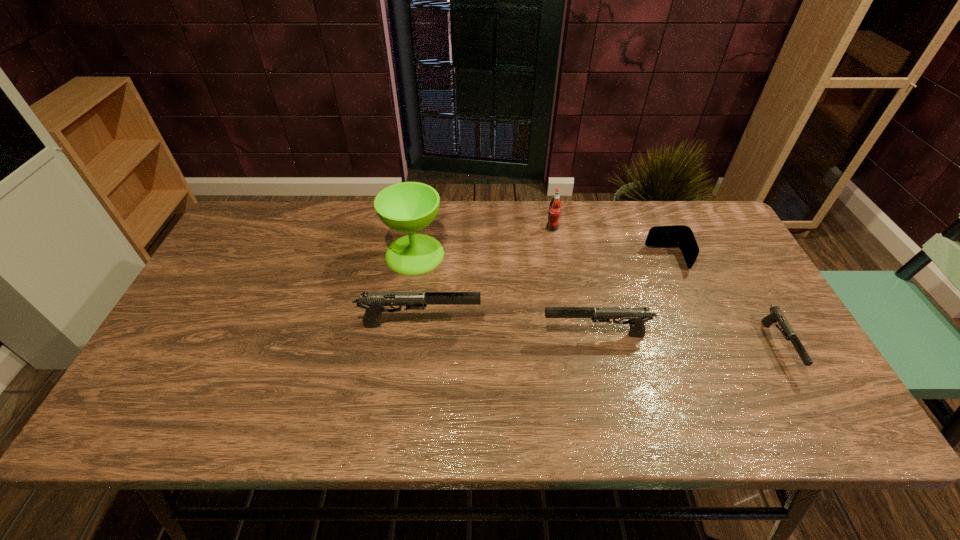
Identify the location of free spot between the tallest object and the shortest gun. (x=596, y=300).

Identify the location of free space between the leftmost gun and the shortest object. (599, 335).

Identify the location of empty location between the wallet and the soda bottle. This screenshot has width=960, height=540. (610, 244).

The height and width of the screenshot is (540, 960). Identify the location of free space between the wallet and the tallest object. (541, 256).

The image size is (960, 540). I want to click on unoccupied position between the second gun from left to right and the soda bottle, so click(574, 282).

Image resolution: width=960 pixels, height=540 pixels. Find the location of `free spot between the tallest object and the second gun from right to left`. free spot between the tallest object and the second gun from right to left is located at coordinates (505, 294).

You are a GUI agent. You are given a task and a screenshot of the screen. Output one action in this format:
    pyautogui.click(x=<x>, y=<y>)
    Task: Click on the empty location between the second tallest gun and the soda bottle
    This screenshot has width=960, height=540.
    Given the screenshot: What is the action you would take?
    pyautogui.click(x=574, y=282)

Where is `free space between the leftmost gun and the farthest object`? The width and height of the screenshot is (960, 540). free space between the leftmost gun and the farthest object is located at coordinates (486, 276).

Image resolution: width=960 pixels, height=540 pixels. I want to click on empty space that is in between the leftmost gun and the tallest object, so click(418, 289).

Locate an element on the screen. vacant area that lies between the second shortest gun and the fifth object from left to right is located at coordinates (632, 296).